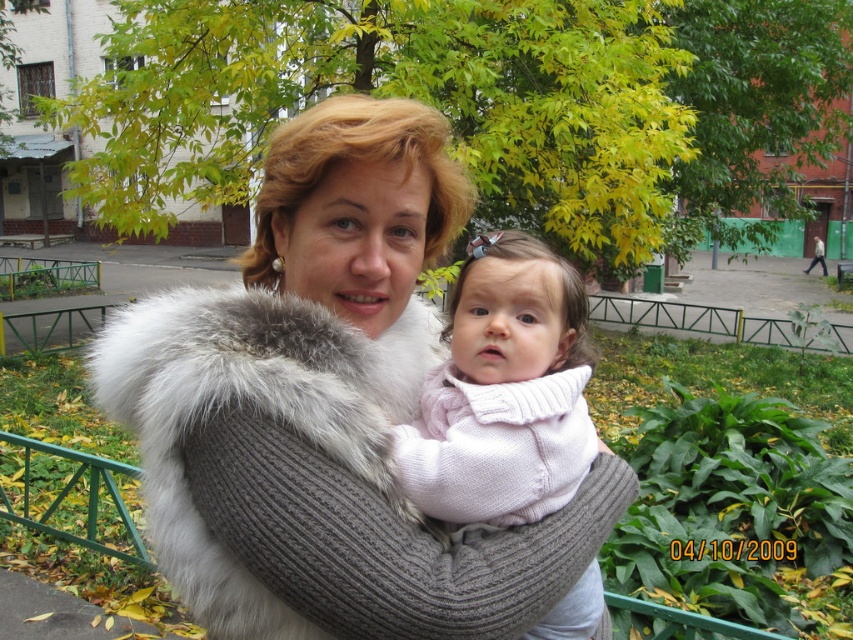
What do you see at coordinates (254, 419) in the screenshot? I see `gray furry scarf at center` at bounding box center [254, 419].

Which is in front, point (173, 593) or point (476, 324)?

Point (476, 324) is more forward.

Where is `gray furry scarf at center`? Image resolution: width=853 pixels, height=640 pixels. gray furry scarf at center is located at coordinates (254, 419).

Identify the location of gray furry scarf at center. (x=254, y=419).